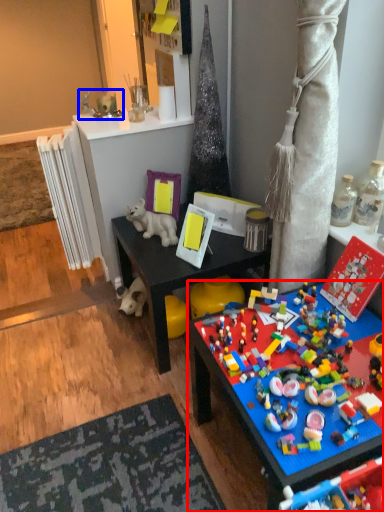
Question: Which object is closer to the camera taking this photo, toy (highlighted by a red box) or toy (highlighted by a blue box)?

Choices:
 (A) toy
 (B) toy

Answer: (A)